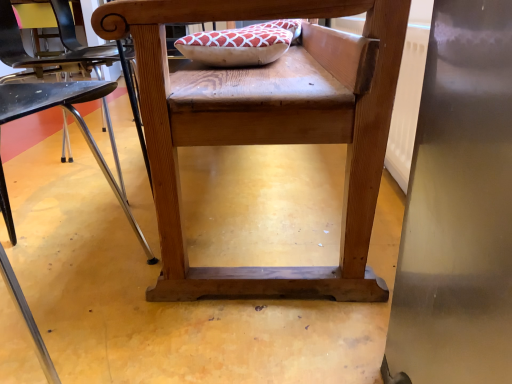
The width and height of the screenshot is (512, 384). I want to click on wooden chair at center, the 1th chair viewed from the right, so 268,127.

Image resolution: width=512 pixels, height=384 pixels. What do you see at coordinates (268, 127) in the screenshot?
I see `wooden chair at center, arranged as the 2th chair when viewed from the left` at bounding box center [268, 127].

What do you see at coordinates (73, 116) in the screenshot?
I see `wooden chair at center, which ranks as the first chair in left-to-right order` at bounding box center [73, 116].

The width and height of the screenshot is (512, 384). I want to click on wooden chair at center, the 2th chair in the right-to-left sequence, so click(x=73, y=116).

This screenshot has height=384, width=512. Identify the location of wooden chair at center, arranged as the 2th chair when viewed from the left. tap(268, 127).

From the picture: In the image, is wooden chair at center, the 1th chair viewed from the right, on the left side or the right side of wooden chair at center, which ranks as the first chair in left-to-right order?

wooden chair at center, the 1th chair viewed from the right, is positioned on wooden chair at center, which ranks as the first chair in left-to-right order,'s right side.

Consider the image. Between wooden chair at center, arranged as the 2th chair when viewed from the left, and wooden chair at center, which ranks as the first chair in left-to-right order, which one is positioned in front?

wooden chair at center, which ranks as the first chair in left-to-right order, is more forward.

Between point (275, 88) and point (15, 96), which one is positioned behind?

The point (275, 88) is farther from the camera.

From the image's perspective, which is above, wooden chair at center, the 1th chair viewed from the right, or wooden chair at center, the 2th chair in the right-to-left sequence?

wooden chair at center, the 1th chair viewed from the right, appears higher in the image.

From a real-world perspective, who is located lower, wooden chair at center, the 1th chair viewed from the right, or wooden chair at center, which ranks as the first chair in left-to-right order?

From a 3D spatial view, wooden chair at center, which ranks as the first chair in left-to-right order, is below.

Can you confirm if wooden chair at center, the 1th chair viewed from the right, is thinner than wooden chair at center, the 2th chair in the right-to-left sequence?

No.

Which of these two, wooden chair at center, the 1th chair viewed from the right, or wooden chair at center, the 2th chair in the right-to-left sequence, stands taller?

Standing taller between the two is wooden chair at center, the 1th chair viewed from the right.

Considering the sizes of wooden chair at center, the 1th chair viewed from the right, and wooden chair at center, which ranks as the first chair in left-to-right order, in the image, is wooden chair at center, the 1th chair viewed from the right, bigger or smaller than wooden chair at center, which ranks as the first chair in left-to-right order,?

wooden chair at center, the 1th chair viewed from the right, is bigger than wooden chair at center, which ranks as the first chair in left-to-right order.

Would you say wooden chair at center, arranged as the 2th chair when viewed from the left, is outside wooden chair at center, the 2th chair in the right-to-left sequence?

wooden chair at center, arranged as the 2th chair when viewed from the left, is positioned outside wooden chair at center, the 2th chair in the right-to-left sequence.

Is wooden chair at center, arranged as the 2th chair when viewed from the left, directly adjacent to wooden chair at center, the 2th chair in the right-to-left sequence?

No, wooden chair at center, arranged as the 2th chair when viewed from the left, is not in contact with wooden chair at center, the 2th chair in the right-to-left sequence.

Is wooden chair at center, the 1th chair viewed from the right, facing away from wooden chair at center, the 2th chair in the right-to-left sequence?

No, wooden chair at center, the 1th chair viewed from the right, is not facing away from wooden chair at center, the 2th chair in the right-to-left sequence.

What's the angular difference between wooden chair at center, the 1th chair viewed from the right, and wooden chair at center, the 2th chair in the right-to-left sequence,'s facing directions?

The facing directions of wooden chair at center, the 1th chair viewed from the right, and wooden chair at center, the 2th chair in the right-to-left sequence, are 90.7 degrees apart.

The width and height of the screenshot is (512, 384). Find the location of `chair below the wooden chair at center, arranged as the 2th chair when viewed from the left (from a real-world perspective)`. chair below the wooden chair at center, arranged as the 2th chair when viewed from the left (from a real-world perspective) is located at coordinates (73, 116).

Is wooden chair at center, the 2th chair in the right-to-left sequence, to the left or to the right of wooden chair at center, the 1th chair viewed from the right, in the image?

wooden chair at center, the 2th chair in the right-to-left sequence, is positioned on wooden chair at center, the 1th chair viewed from the right,'s left side.

Is wooden chair at center, which ranks as the first chair in left-to-right order, in front of wooden chair at center, the 1th chair viewed from the right?

Yes.

Does point (106, 87) come in front of point (253, 104)?

No.

From the image's perspective, does wooden chair at center, the 2th chair in the right-to-left sequence, appear lower than wooden chair at center, the 1th chair viewed from the right?

Yes, from the image's perspective, wooden chair at center, the 2th chair in the right-to-left sequence, is beneath wooden chair at center, the 1th chair viewed from the right.

From a real-world perspective, who is located higher, wooden chair at center, which ranks as the first chair in left-to-right order, or wooden chair at center, arranged as the 2th chair when viewed from the left?

In real-world perspective, wooden chair at center, arranged as the 2th chair when viewed from the left, is above.

Looking at this image, considering the sizes of objects wooden chair at center, the 2th chair in the right-to-left sequence, and wooden chair at center, the 1th chair viewed from the right, in the image provided, who is thinner, wooden chair at center, the 2th chair in the right-to-left sequence, or wooden chair at center, the 1th chair viewed from the right,?

wooden chair at center, the 2th chair in the right-to-left sequence.

Is wooden chair at center, the 2th chair in the right-to-left sequence, taller or shorter than wooden chair at center, arranged as the 2th chair when viewed from the left?

wooden chair at center, the 2th chair in the right-to-left sequence, is shorter than wooden chair at center, arranged as the 2th chair when viewed from the left.

Can you confirm if wooden chair at center, the 2th chair in the right-to-left sequence, is smaller than wooden chair at center, the 1th chair viewed from the right?

Yes, wooden chair at center, the 2th chair in the right-to-left sequence, is smaller than wooden chair at center, the 1th chair viewed from the right.

Choose the correct answer: Is wooden chair at center, the 2th chair in the right-to-left sequence, inside wooden chair at center, arranged as the 2th chair when viewed from the left, or outside it?

The correct answer is: outside.

Is wooden chair at center, the 2th chair in the right-to-left sequence, next to wooden chair at center, arranged as the 2th chair when viewed from the left?

No, wooden chair at center, the 2th chair in the right-to-left sequence, is not in contact with wooden chair at center, arranged as the 2th chair when viewed from the left.

Could you tell me if wooden chair at center, the 2th chair in the right-to-left sequence, is facing wooden chair at center, arranged as the 2th chair when viewed from the left?

No, wooden chair at center, the 2th chair in the right-to-left sequence, is not oriented towards wooden chair at center, arranged as the 2th chair when viewed from the left.

Where is `chair that is on the right side of wooden chair at center, the 2th chair in the right-to-left sequence`? chair that is on the right side of wooden chair at center, the 2th chair in the right-to-left sequence is located at coordinates (268, 127).

Find the location of a particular element. This screenshot has height=384, width=512. chair above the wooden chair at center, the 2th chair in the right-to-left sequence (from the image's perspective) is located at coordinates (268, 127).

Locate an element on the screen. The height and width of the screenshot is (384, 512). chair above the wooden chair at center, the 2th chair in the right-to-left sequence (from a real-world perspective) is located at coordinates (268, 127).